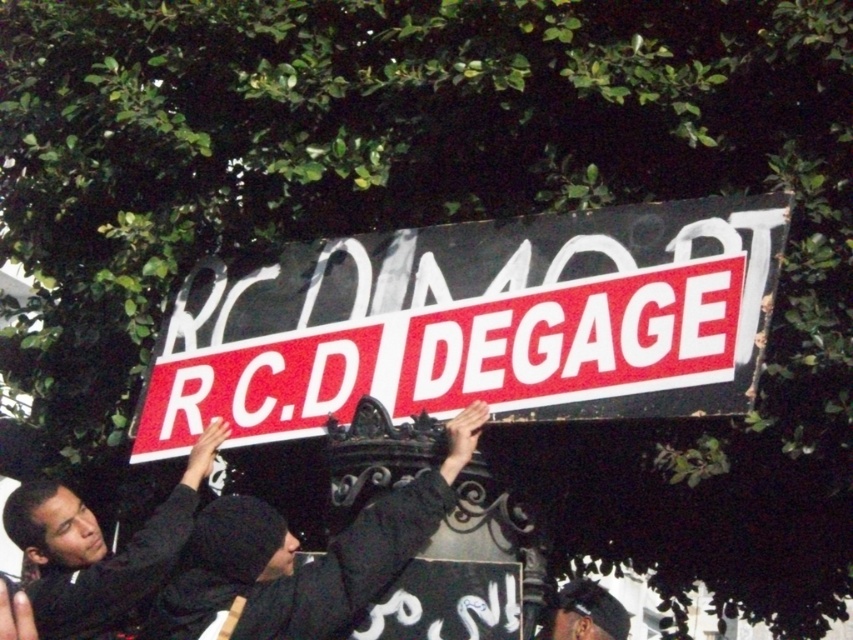
Question: Based on their relative distances, which object is farther from the black matte clothing at center?

Choices:
 (A) black matte shirt at center
 (B) red plastic sign at center

Answer: (B)

Question: Is black matte clothing at center smaller than black matte shirt at center?

Choices:
 (A) no
 (B) yes

Answer: (B)

Question: Is black matte clothing at center thinner than black matte shirt at center?

Choices:
 (A) no
 (B) yes

Answer: (A)

Question: Can you confirm if red plastic sign at center is bigger than black matte shirt at center?

Choices:
 (A) yes
 (B) no

Answer: (A)

Question: Which object is closer to the camera taking this photo?

Choices:
 (A) red plastic sign at center
 (B) black matte shirt at center
 (C) black matte clothing at center

Answer: (A)

Question: Which object is positioned closest to the red plastic sign at center?

Choices:
 (A) dark gray knit cap at center
 (B) black matte clothing at center

Answer: (B)